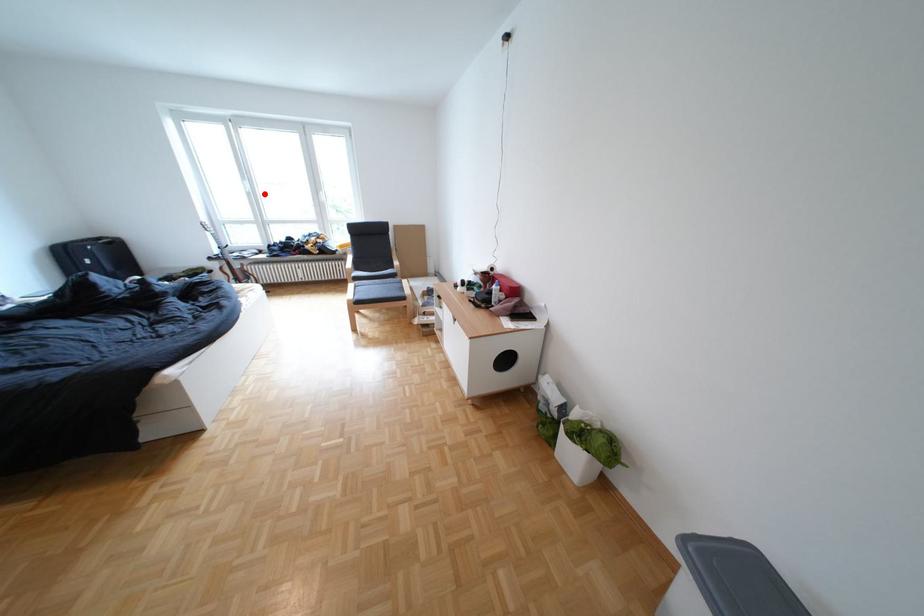
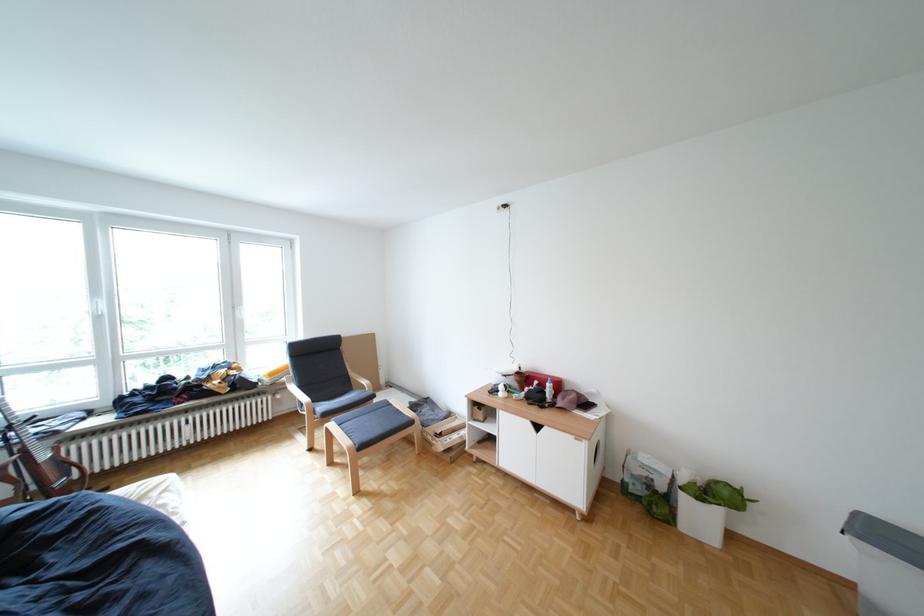
In the second image, find the point that corresponds to the highlighted location in the first image.

(114, 318)